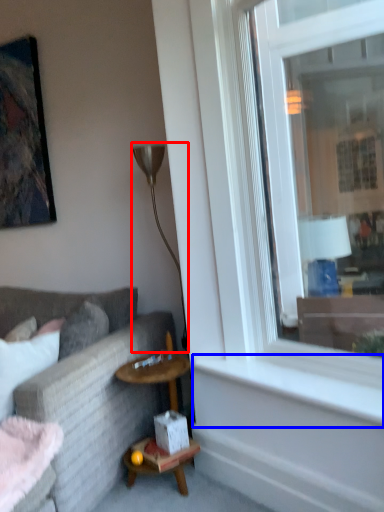
Question: Which of the following is the closest to the observer, lamp (highlighted by a red box) or window sill (highlighted by a blue box)?

Choices:
 (A) lamp
 (B) window sill

Answer: (B)